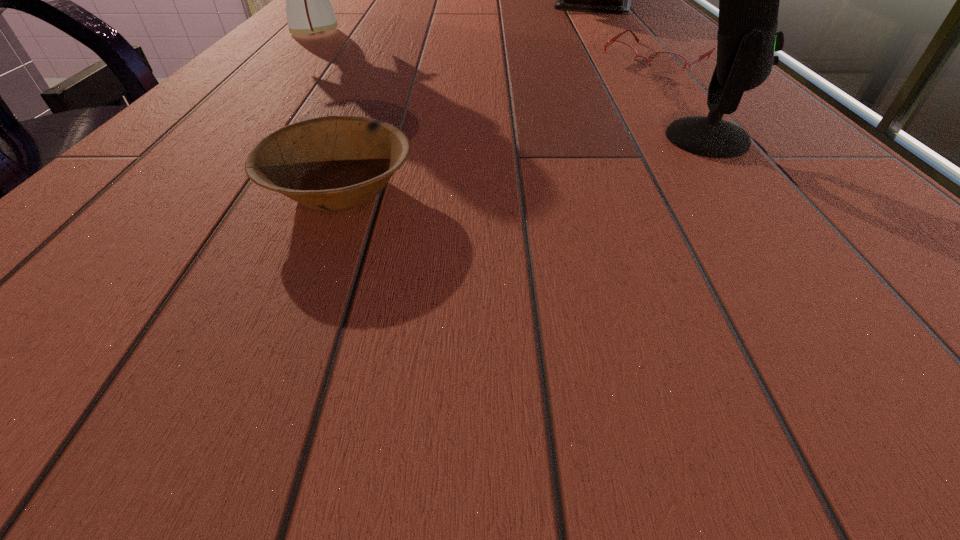
Locate an element on the screen. This screenshot has width=960, height=540. vacant space on the desktop that is between the second shortest object and the microphone and is positioned on the lenses of the shortest object is located at coordinates (496, 167).

I want to click on free spot on the desktop that is between the bowl and the microphone and is positioned on the horn of the phonograph_record, so click(499, 167).

Identify the location of free space on the desktop that is between the bowl and the microphone and is positioned at the front face of the leftmost object. (560, 159).